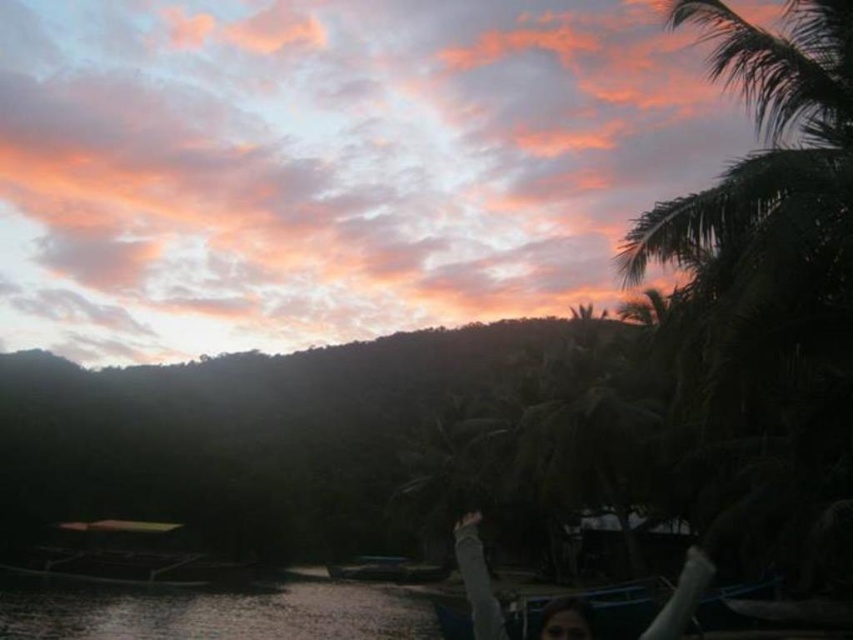
Can you confirm if smooth skin person at lower center is smaller than metallic blue boat at center?

No, smooth skin person at lower center is not smaller than metallic blue boat at center.

Based on the photo, can you confirm if smooth skin person at lower center is taller than metallic blue boat at center?

Yes, smooth skin person at lower center is taller than metallic blue boat at center.

Identify the location of smooth skin person at lower center. This screenshot has width=853, height=640. (477, 579).

Can you confirm if clear water at lower left is wider than smooth skin person at lower center?

Yes, clear water at lower left is wider than smooth skin person at lower center.

Is clear water at lower left taller than smooth skin person at lower center?

Incorrect, clear water at lower left's height is not larger of smooth skin person at lower center's.

Is point (364, 586) closer to camera compared to point (469, 544)?

No, (364, 586) is behind (469, 544).

Where is `clear water at lower left`? Image resolution: width=853 pixels, height=640 pixels. clear water at lower left is located at coordinates point(212,611).

Can you confirm if clear water at lower left is smaller than metallic blue boat at center?

Actually, clear water at lower left might be larger than metallic blue boat at center.

Is point (383, 637) more distant than point (444, 568)?

No, (383, 637) is closer to viewer.

Which is behind, point (329, 604) or point (395, 561)?

Positioned behind is point (395, 561).

You are a GUI agent. You are given a task and a screenshot of the screen. Output one action in this format:
    pyautogui.click(x=<x>, y=<y>)
    Task: Click on the clear water at lower left
    This screenshot has height=640, width=853.
    Given the screenshot: What is the action you would take?
    212,611